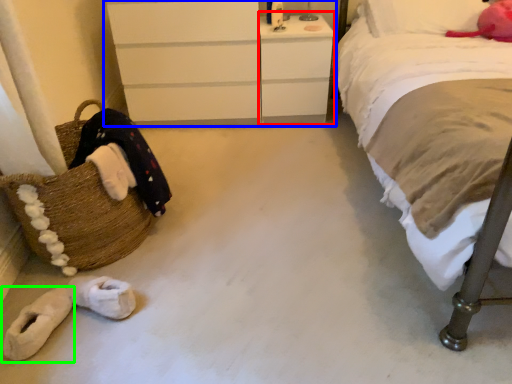
Question: Which object is positioned farthest from vanity (highlighted by a red box)? Select from chest of drawers (highlighted by a blue box) and footwear (highlighted by a green box).

Choices:
 (A) chest of drawers
 (B) footwear

Answer: (B)